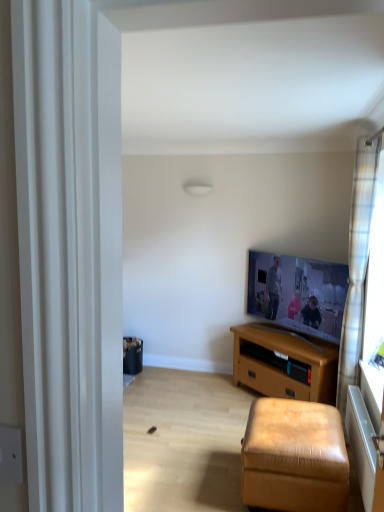
Question: Is leather-like stool at lower right closer to the viewer compared to brown wooden tv stand at center?

Choices:
 (A) yes
 (B) no

Answer: (A)

Question: Can you confirm if leather-like stool at lower right is shorter than brown wooden tv stand at center?

Choices:
 (A) yes
 (B) no

Answer: (A)

Question: Is leather-like stool at lower right to the left of brown wooden tv stand at center from the viewer's perspective?

Choices:
 (A) no
 (B) yes

Answer: (B)

Question: Is leather-like stool at lower right facing away from brown wooden tv stand at center?

Choices:
 (A) no
 (B) yes

Answer: (A)

Question: Can you see leather-like stool at lower right touching brown wooden tv stand at center?

Choices:
 (A) no
 (B) yes

Answer: (A)

Question: Considering the relative positions of leather-like stool at lower right and brown wooden tv stand at center in the image provided, is leather-like stool at lower right to the right of brown wooden tv stand at center from the viewer's perspective?

Choices:
 (A) no
 (B) yes

Answer: (A)

Question: Can you confirm if leather-like stool at lower right is smaller than flat screen tv at upper right?

Choices:
 (A) yes
 (B) no

Answer: (B)

Question: Is leather-like stool at lower right at the left side of flat screen tv at upper right?

Choices:
 (A) no
 (B) yes

Answer: (B)

Question: From a real-world perspective, is leather-like stool at lower right positioned under flat screen tv at upper right based on gravity?

Choices:
 (A) yes
 (B) no

Answer: (A)

Question: From the image's perspective, is leather-like stool at lower right beneath flat screen tv at upper right?

Choices:
 (A) no
 (B) yes

Answer: (B)

Question: From the image's perspective, is leather-like stool at lower right over flat screen tv at upper right?

Choices:
 (A) yes
 (B) no

Answer: (B)

Question: Would you say flat screen tv at upper right is part of leather-like stool at lower right's contents?

Choices:
 (A) yes
 (B) no

Answer: (B)

Question: Could you tell me if brown wooden tv stand at center is turned towards plaid fabric curtain at right?

Choices:
 (A) yes
 (B) no

Answer: (B)